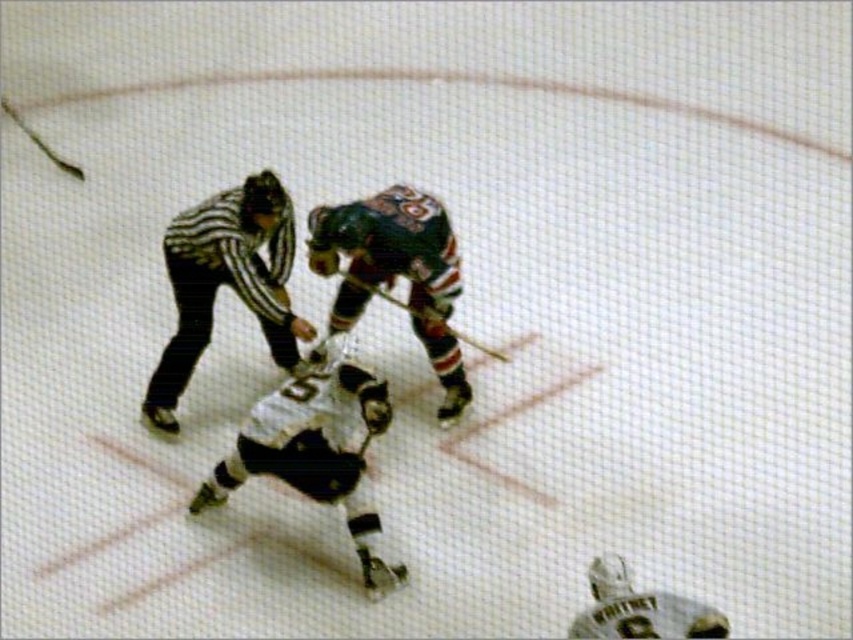
Can you confirm if white matte helmet at lower right is shorter than wooden hockey stick at center?

Indeed, white matte helmet at lower right has a lesser height compared to wooden hockey stick at center.

Consider the image. Does white matte helmet at lower right appear under wooden hockey stick at center?

Indeed, white matte helmet at lower right is positioned under wooden hockey stick at center.

Is point (602, 584) positioned after point (451, 326)?

That is False.

Identify the location of white matte helmet at lower right. This screenshot has height=640, width=853. (640, 609).

How much distance is there between striped jersey referee at center and wooden hockey stick at center?

22.03 inches

What do you see at coordinates (225, 282) in the screenshot?
I see `striped jersey referee at center` at bounding box center [225, 282].

This screenshot has width=853, height=640. I want to click on striped jersey referee at center, so click(x=225, y=282).

Is shiny green hockey stick at center further to the viewer compared to white matte helmet at lower right?

Yes, it is behind white matte helmet at lower right.

Who is more forward, (392, 228) or (643, 620)?

Positioned in front is point (643, 620).

You are a GUI agent. You are given a task and a screenshot of the screen. Output one action in this format:
    pyautogui.click(x=<x>, y=<y>)
    Task: Click on the shiny green hockey stick at center
    
    Given the screenshot: What is the action you would take?
    pyautogui.click(x=396, y=272)